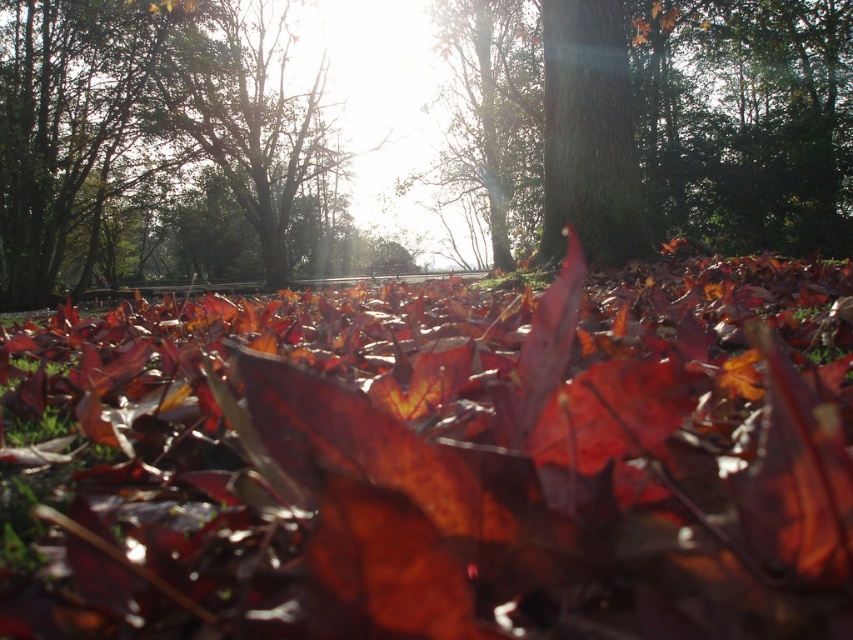
Between point (115, 358) and point (619, 225), which one is positioned behind?

Point (619, 225)

Which of these two, shiny red leaves at center or green rough bark tree at center, stands shorter?

Standing shorter between the two is shiny red leaves at center.

Is point (525, 488) less distant than point (563, 54)?

Yes, point (525, 488) is in front of point (563, 54).

Locate an element on the screen. This screenshot has height=640, width=853. shiny red leaves at center is located at coordinates (444, 460).

Which is more to the left, shiny red leaves at center or smooth bark tree at center?

shiny red leaves at center

Identify the location of shiny red leaves at center. (444, 460).

The image size is (853, 640). What do you see at coordinates (444, 460) in the screenshot? I see `shiny red leaves at center` at bounding box center [444, 460].

Where is `shiny red leaves at center`? This screenshot has height=640, width=853. shiny red leaves at center is located at coordinates (444, 460).

Image resolution: width=853 pixels, height=640 pixels. What do you see at coordinates (675, 124) in the screenshot?
I see `smooth bark tree at center` at bounding box center [675, 124].

Locate an element on the screen. The height and width of the screenshot is (640, 853). smooth bark tree at center is located at coordinates (675, 124).